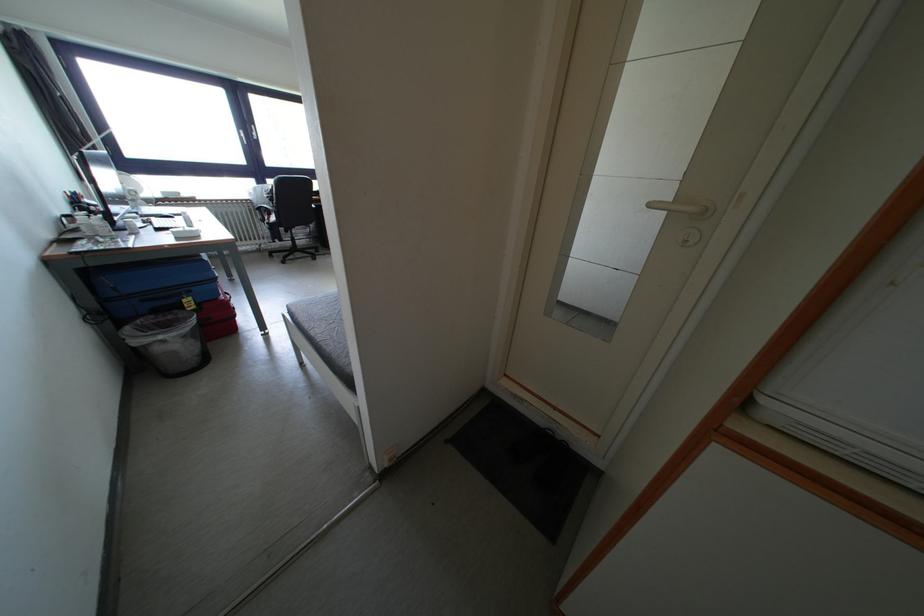
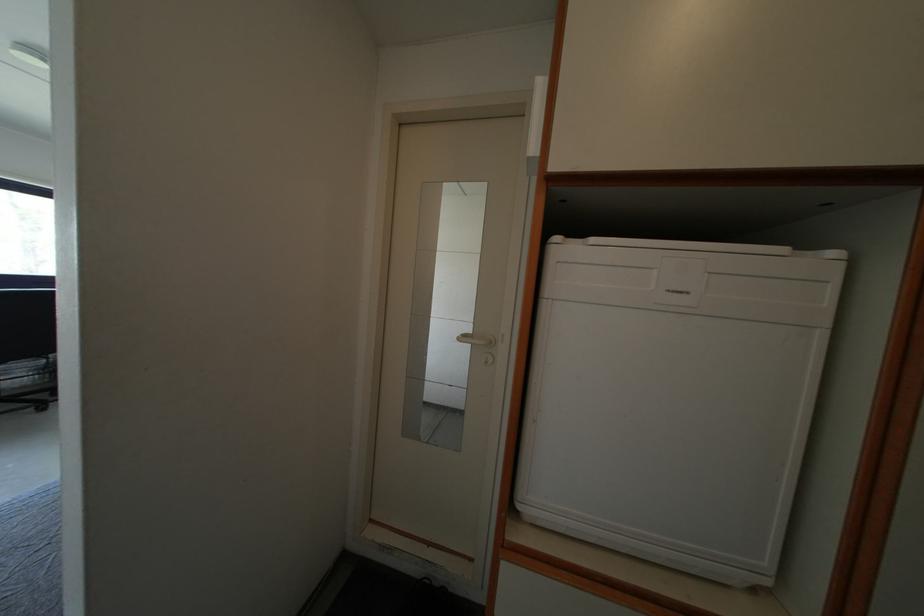
Find the pixel in the second image that matches (x=660, y=209) in the first image.

(468, 342)